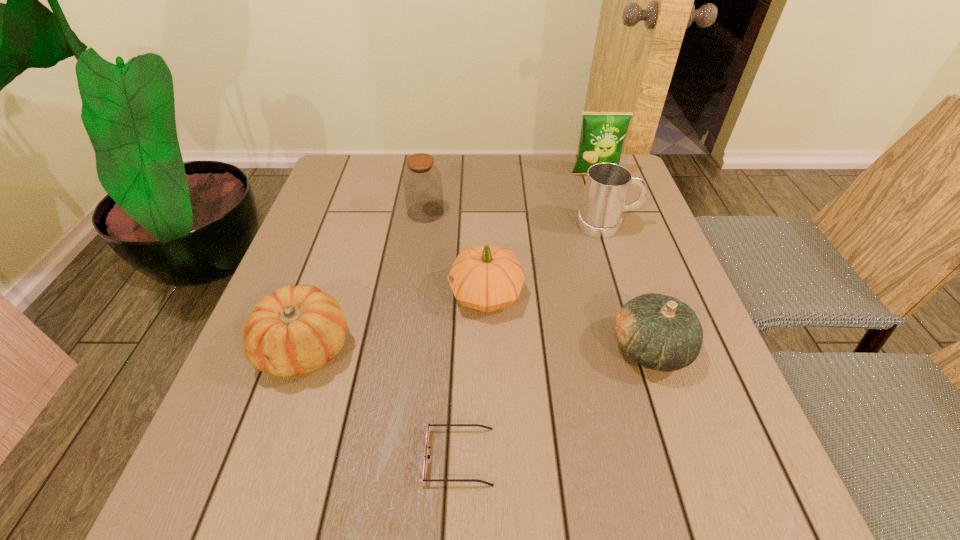
Where is `gourd that is the second closest to the second gourd from left to right`? Image resolution: width=960 pixels, height=540 pixels. gourd that is the second closest to the second gourd from left to right is located at coordinates (296, 330).

Locate an element on the screen. the closest gourd relative to the leftmost object is located at coordinates (486, 278).

The height and width of the screenshot is (540, 960). Find the location of `free spot that satisfies the following two spatial constraints: 1. on the back side of the rightmost gourd; 2. on the side of the mug with the handle`. free spot that satisfies the following two spatial constraints: 1. on the back side of the rightmost gourd; 2. on the side of the mug with the handle is located at coordinates (610, 225).

In order to click on free space that satisfies the following two spatial constraints: 1. on the front-facing side of the farthest object; 2. on the side of the mug with the handle in this screenshot , I will do `click(612, 225)`.

Find the location of `blank area in the image that satisfies the following two spatial constraints: 1. on the side of the second gourd from left to right with the carved face; 2. on the right side of the rightmost gourd`. blank area in the image that satisfies the following two spatial constraints: 1. on the side of the second gourd from left to right with the carved face; 2. on the right side of the rightmost gourd is located at coordinates (487, 348).

This screenshot has width=960, height=540. Identify the location of vacant area in the image that satisfies the following two spatial constraints: 1. on the side of the rightmost gourd with the handle; 2. on the right side of the mug. (648, 348).